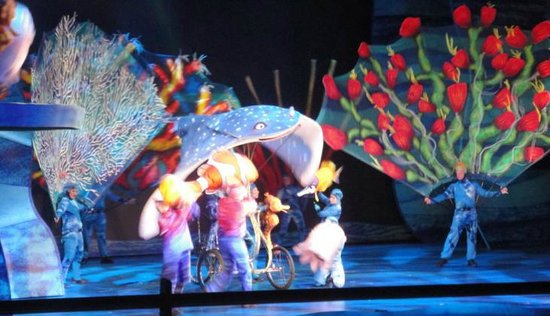
This screenshot has height=316, width=550. I want to click on stage, so click(448, 310).